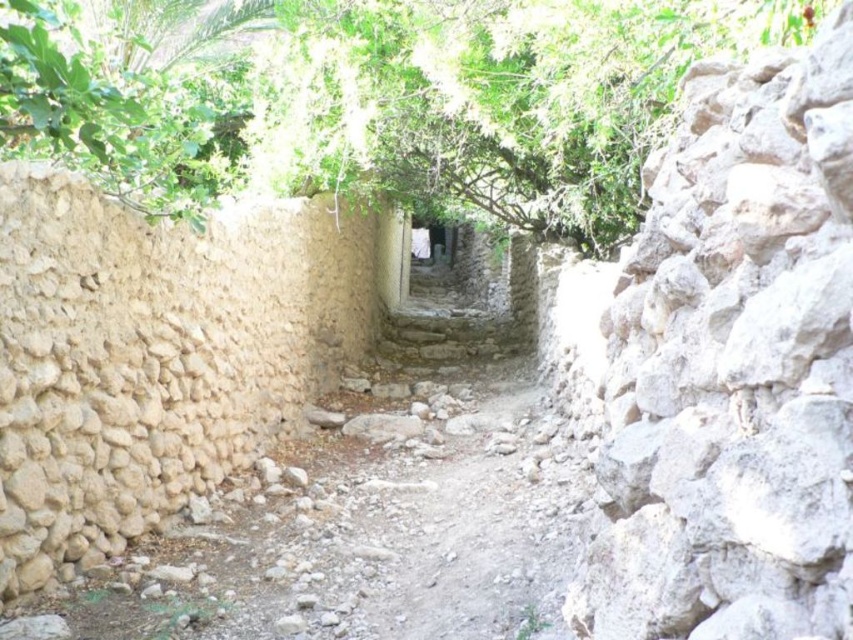
Question: Observing the image, what is the correct spatial positioning of green leafy tree at upper center in reference to gray rough stone wall at right?

Choices:
 (A) left
 (B) right

Answer: (A)

Question: Can you confirm if green leafy tree at upper center is positioned to the left of gray rough stone wall at right?

Choices:
 (A) yes
 (B) no

Answer: (A)

Question: Which of the following is the farthest from the observer?

Choices:
 (A) green leafy tree at upper center
 (B) gray rough stone wall at right

Answer: (A)

Question: Is green leafy tree at upper center above gray rough stone wall at right?

Choices:
 (A) no
 (B) yes

Answer: (B)

Question: Which point is farther to the camera?

Choices:
 (A) (276, 51)
 (B) (738, 602)

Answer: (A)

Question: Which of the following is the closest to the observer?

Choices:
 (A) green leafy tree at upper center
 (B) gray rough stone wall at right

Answer: (B)